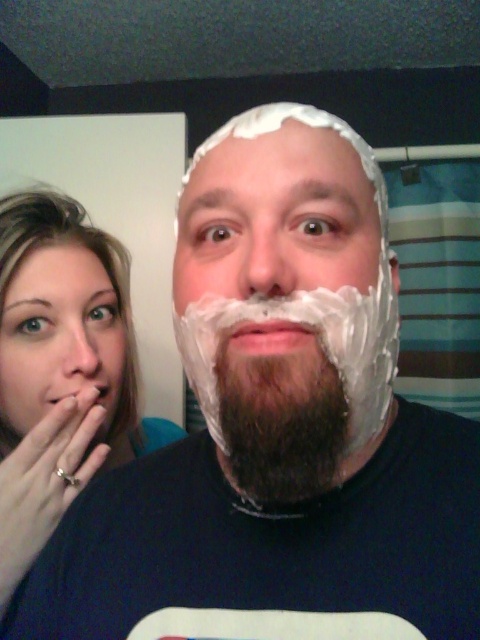
Who is more forward, (254,369) or (288,353)?

Point (288,353) is in front.

Measure the distance from dark brown beard at center to white foam at center.

dark brown beard at center is 1.52 inches from white foam at center.

Who is more distant from viewer, (335, 385) or (298, 330)?

The point (335, 385) is behind.

Locate an element on the screen. dark brown beard at center is located at coordinates (279, 422).

Can you confirm if white creamy foam at center is bigger than white foam at center?

Correct, white creamy foam at center is larger in size than white foam at center.

Looking at this image, does white creamy foam at center have a greater width compared to white foam at center?

No.

What do you see at coordinates (266, 259) in the screenshot? The image size is (480, 640). I see `white creamy foam at center` at bounding box center [266, 259].

Where is `white creamy foam at center`? The image size is (480, 640). white creamy foam at center is located at coordinates (266, 259).

Does blonde hair at left come in front of white creamy foam at center?

No.

Can you confirm if blonde hair at left is smaller than white creamy foam at center?

Actually, blonde hair at left might be larger than white creamy foam at center.

Where is `blonde hair at left`? blonde hair at left is located at coordinates (59, 371).